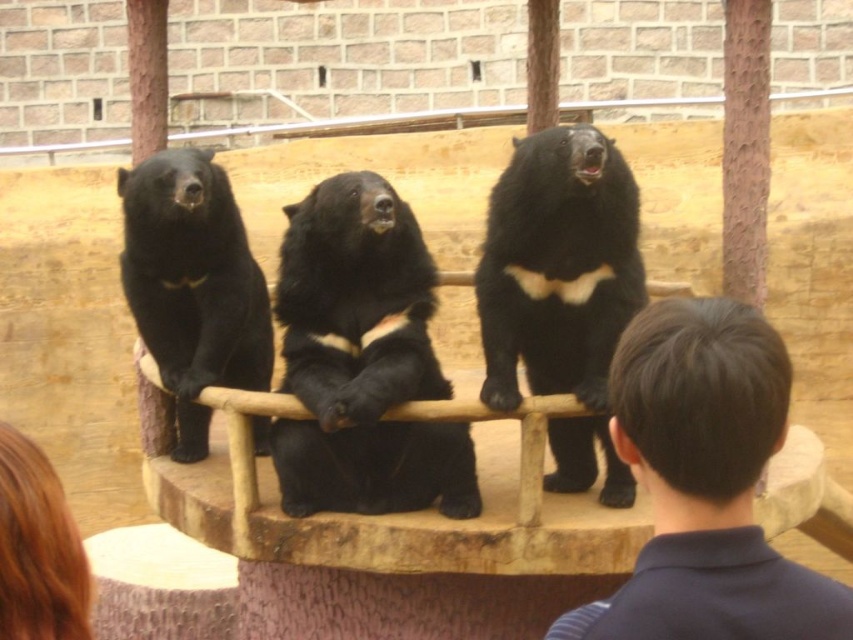
Is black furry bear at center taller than black fur bear at left?

Yes, black furry bear at center is taller than black fur bear at left.

Does black furry bear at center have a larger size compared to black fur bear at left?

Indeed, black furry bear at center has a larger size compared to black fur bear at left.

Between point (558, 371) and point (201, 179), which one is positioned behind?

The point (558, 371) is more distant.

Locate an element on the screen. black furry bear at center is located at coordinates (561, 291).

Which is below, black fur bear at center or black furry bear at center?

black fur bear at center is lower down.

Does black fur bear at center have a smaller size compared to black furry bear at center?

Actually, black fur bear at center might be larger than black furry bear at center.

Which is in front, point (332, 497) or point (543, 164)?

Point (543, 164) is more forward.

This screenshot has width=853, height=640. Find the location of `black fur bear at center`. black fur bear at center is located at coordinates tap(363, 358).

Between point (711, 490) and point (151, 320), which one is positioned behind?

The point (151, 320) is behind.

Measure the distance between point [732,596] and camera.

Point [732,596] is 25.75 meters away from camera.

Where is `dark brown hair at upper right`? dark brown hair at upper right is located at coordinates (705, 483).

Where is `dark brown hair at upper right`? dark brown hair at upper right is located at coordinates (705, 483).